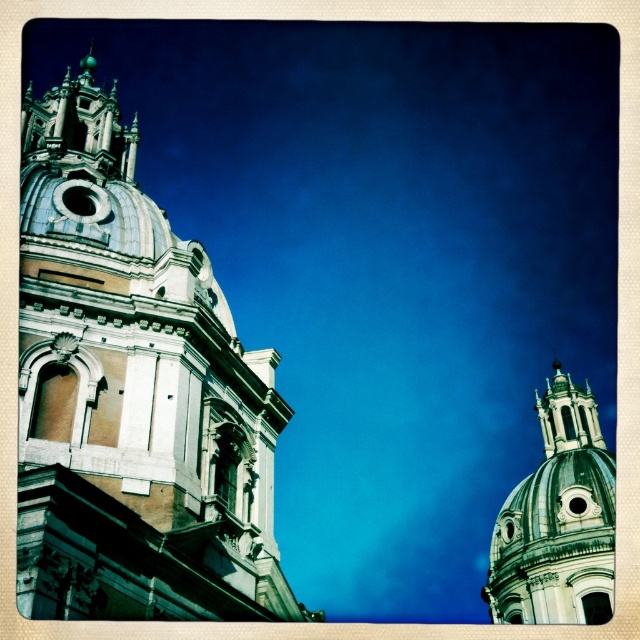
Question: Does white stone church at left have a larger size compared to white marble dome at upper right?

Choices:
 (A) no
 (B) yes

Answer: (B)

Question: Does white stone church at left have a lesser width compared to white marble dome at upper right?

Choices:
 (A) yes
 (B) no

Answer: (B)

Question: Which object appears farthest from the camera in this image?

Choices:
 (A) white marble dome at upper right
 (B) white stone church at left

Answer: (A)

Question: Which object appears closest to the camera in this image?

Choices:
 (A) white stone church at left
 (B) white marble dome at upper right

Answer: (A)

Question: Which object appears farthest from the camera in this image?

Choices:
 (A) white marble dome at upper right
 (B) white stone church at left

Answer: (A)

Question: Does white stone church at left appear over white marble dome at upper right?

Choices:
 (A) no
 (B) yes

Answer: (B)